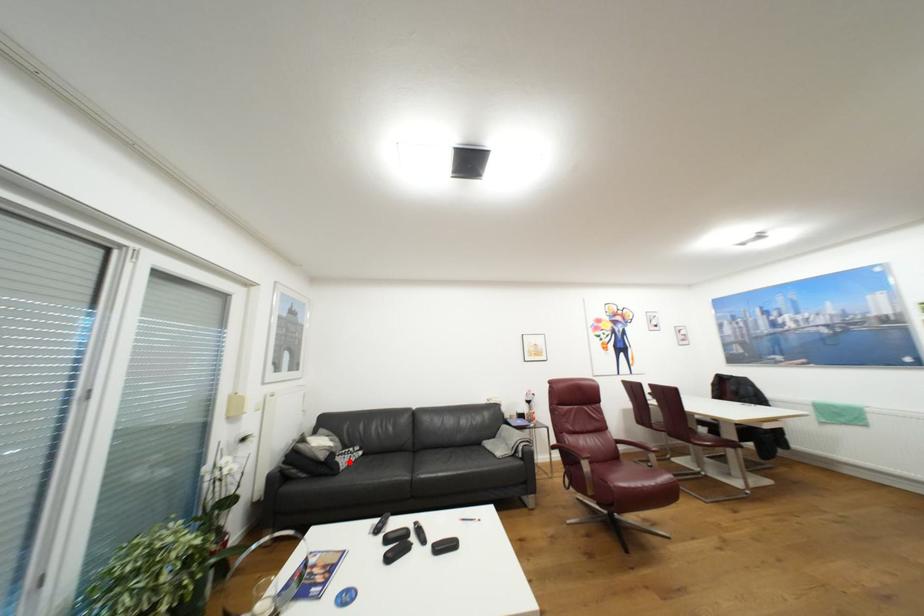
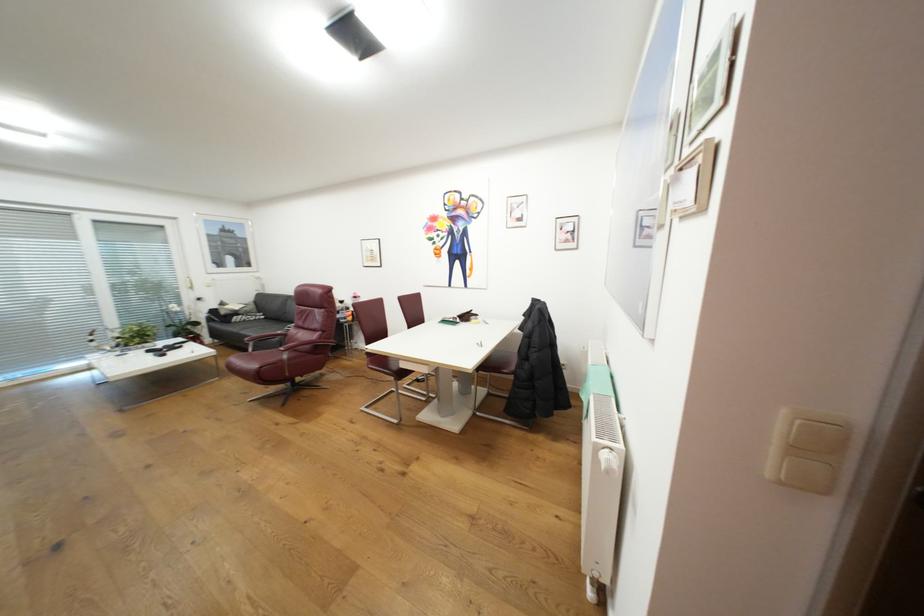
The point at the highlighted location is marked in the first image. Where is the corresponding point in the second image?

(244, 318)